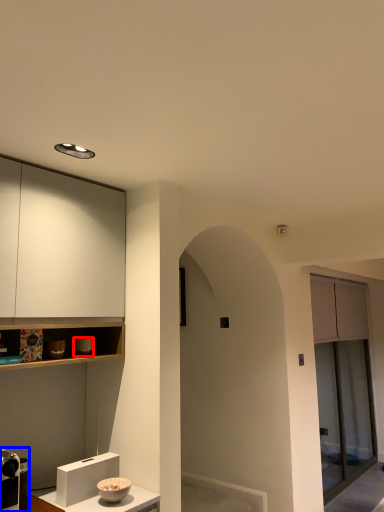
Question: Which of the following is the farthest to the observer, appliance (highlighted by a red box) or appliance (highlighted by a blue box)?

Choices:
 (A) appliance
 (B) appliance

Answer: (A)